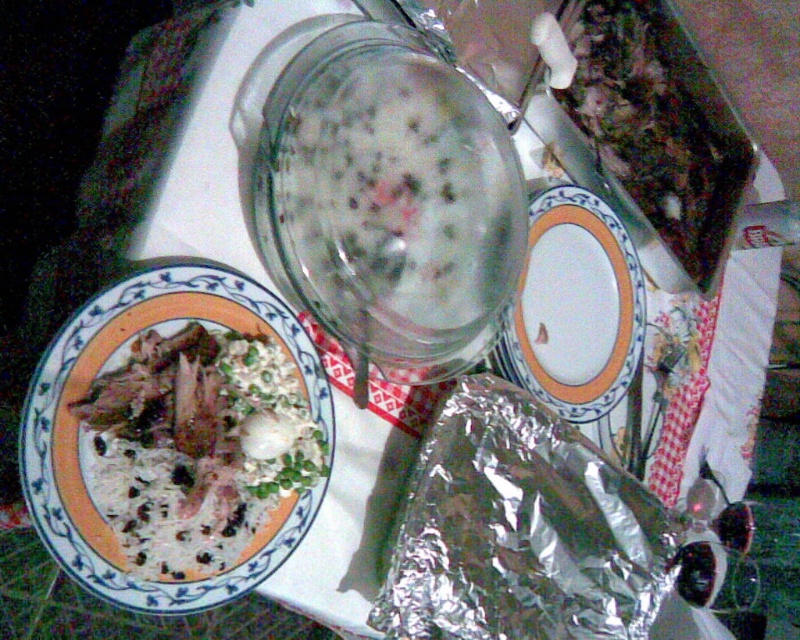
Can you confirm if shiny metallic foil at lower right is wider than white matte rice bowl at left?

Yes, shiny metallic foil at lower right is wider than white matte rice bowl at left.

Who is more forward, (608, 612) or (184, 355)?

Point (184, 355) is in front.

Locate an element on the screen. shiny metallic foil at lower right is located at coordinates (526, 532).

Is point (604, 577) closer to viewer compared to point (532, 388)?

That is True.

Is shiny metallic foil at lower right to the right of white ceramic plate at center from the viewer's perspective?

In fact, shiny metallic foil at lower right is to the left of white ceramic plate at center.

Is point (580, 637) behind point (545, 212)?

No.

The height and width of the screenshot is (640, 800). What are the coordinates of `shiny metallic foil at lower right` in the screenshot? It's located at (526, 532).

Between point (464, 337) and point (620, 33), which one is positioned in front?

Positioned in front is point (464, 337).

Does translucent glass jar at center appear on the left side of green leafy vegetables at upper right?

Yes, translucent glass jar at center is to the left of green leafy vegetables at upper right.

This screenshot has height=640, width=800. What do you see at coordinates (381, 195) in the screenshot?
I see `translucent glass jar at center` at bounding box center [381, 195].

Locate an element on the screen. The height and width of the screenshot is (640, 800). translucent glass jar at center is located at coordinates (381, 195).